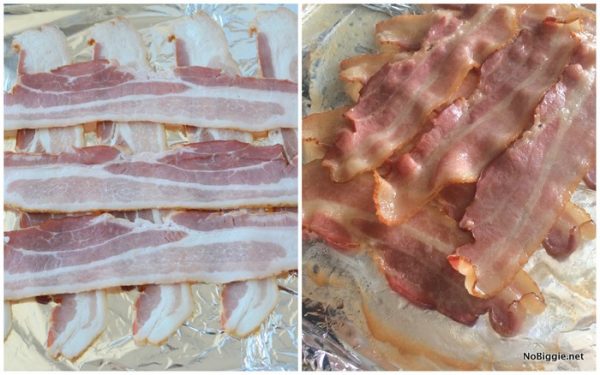
Where is `bottom strip`? bottom strip is located at coordinates pos(141,275).